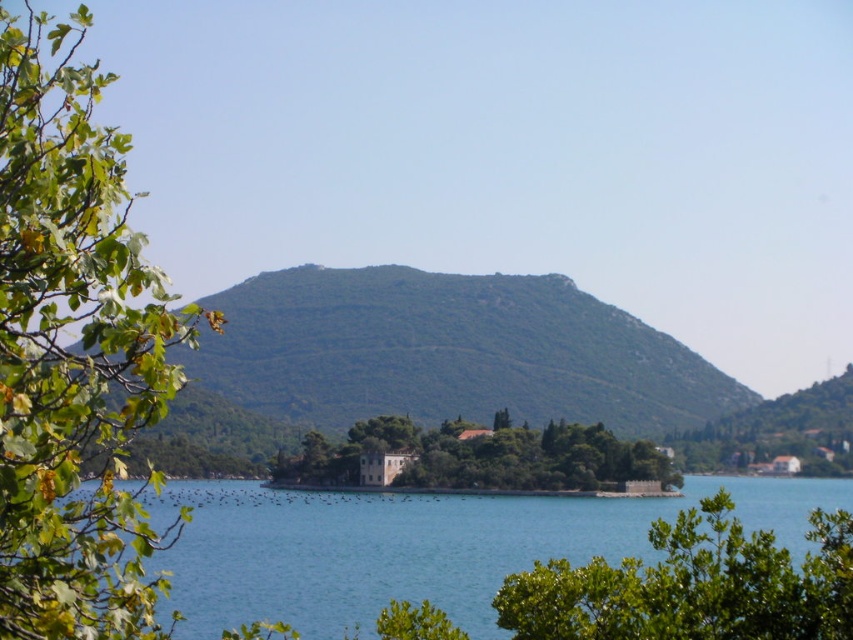
You are standing at the center of the image and want to walk towards the green textured hill at center. Which direction should you move?

The green textured hill at center is already at the center of the image, so you don not need to move in any direction to face it.

You are standing at a viewpoint looking at the green textured hill at center and the green leafy tree at center. Which object is closer to you?

The green textured hill at center is closer to you because it is positioned further to the viewer than the green leafy tree at center.